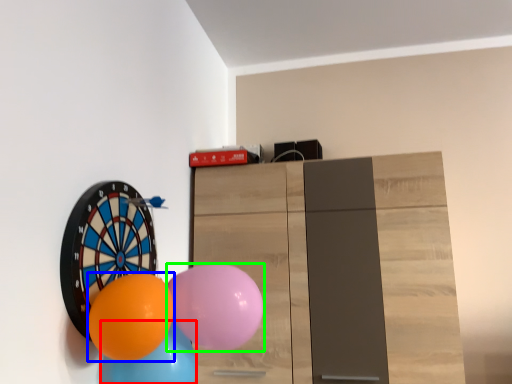
Question: Estimate the real-world distances between objects in this image. Which object is closer to balloon (highlighted by a red box), balloon (highlighted by a blue box) or balloon (highlighted by a green box)?

Choices:
 (A) balloon
 (B) balloon

Answer: (A)